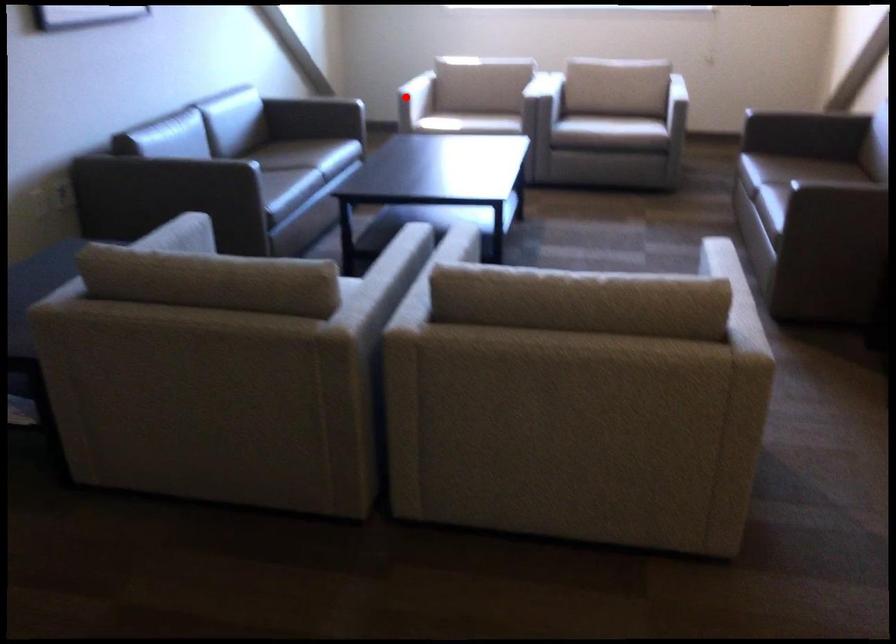
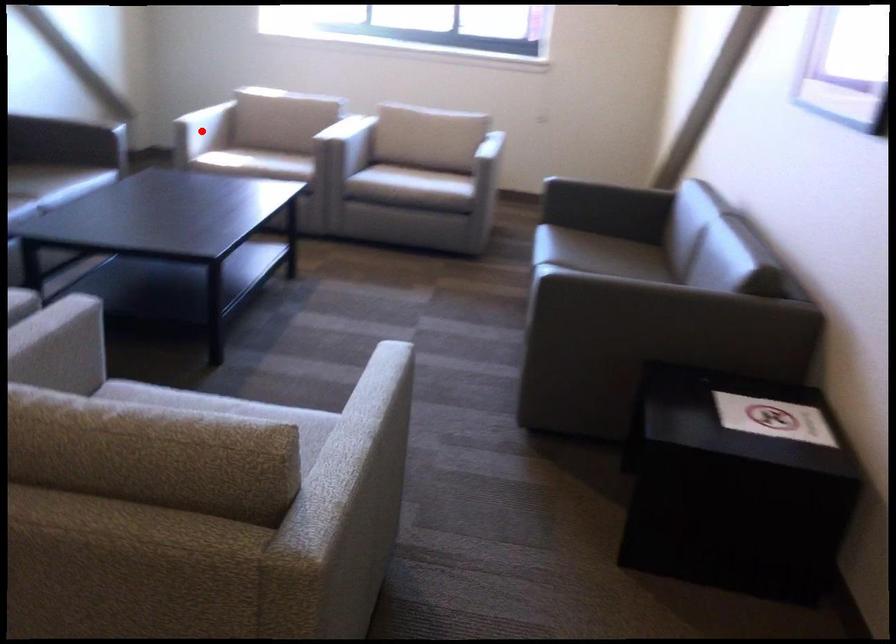
Consider the image. I am providing you with two images of the same scene from different viewpoints. A red point is marked on the first image and another point is marked on the second image. Is the red point in image1 aligned with the point shown in image2?

Yes